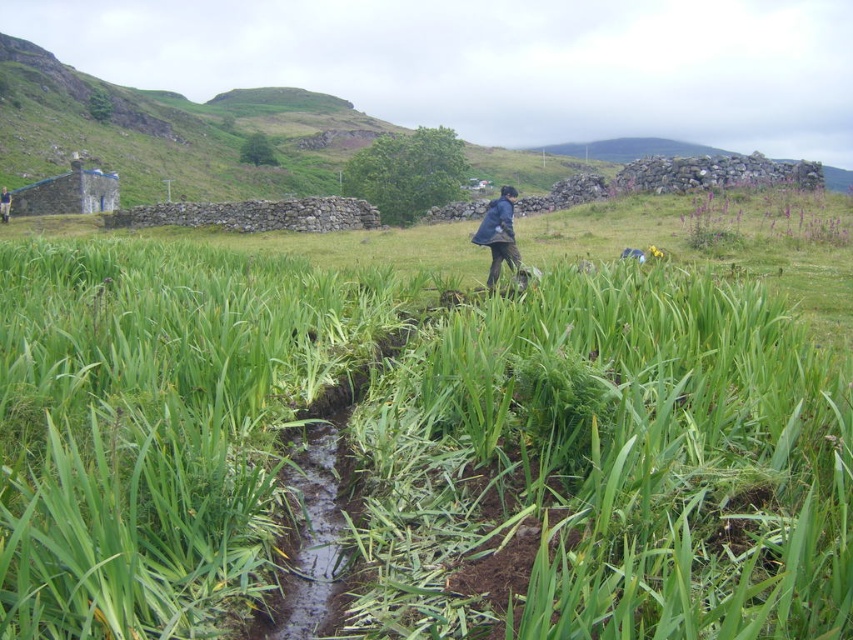
Question: Which point is farther to the camera?

Choices:
 (A) green grassy at center
 (B) blue fabric at center
 (C) blue fabric jacket at center

Answer: (B)

Question: Does green grassy at center have a larger size compared to blue fabric at center?

Choices:
 (A) no
 (B) yes

Answer: (B)

Question: In this image, where is green grassy at center located relative to blue fabric at center?

Choices:
 (A) left
 (B) right

Answer: (B)

Question: Which point appears closest to the camera in this image?

Choices:
 (A) (401, 385)
 (B) (6, 220)

Answer: (A)

Question: Which of the following is the closest to the observer?

Choices:
 (A) (582, 387)
 (B) (480, 228)
 (C) (6, 218)

Answer: (A)

Question: Is green grassy at center thinner than blue fabric jacket at center?

Choices:
 (A) no
 (B) yes

Answer: (A)